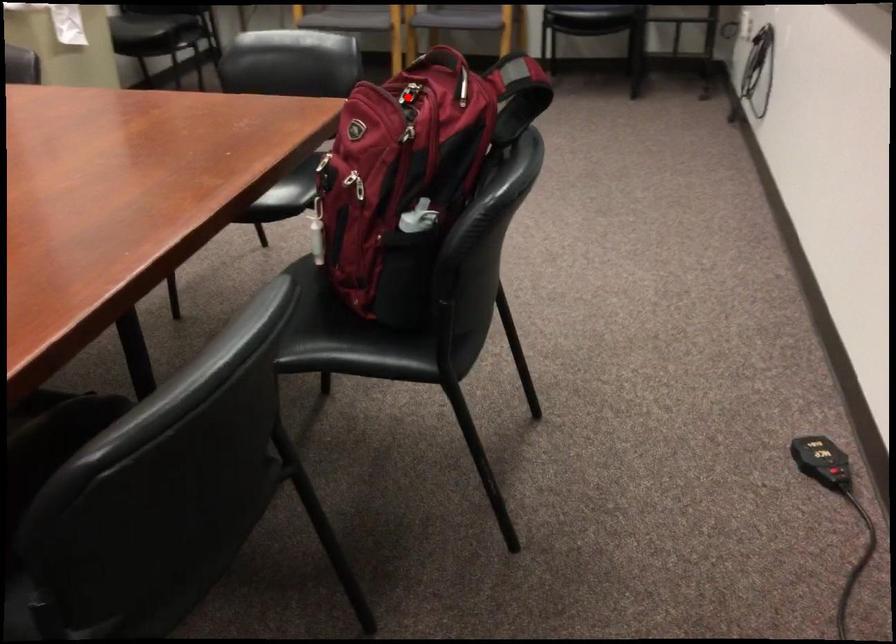
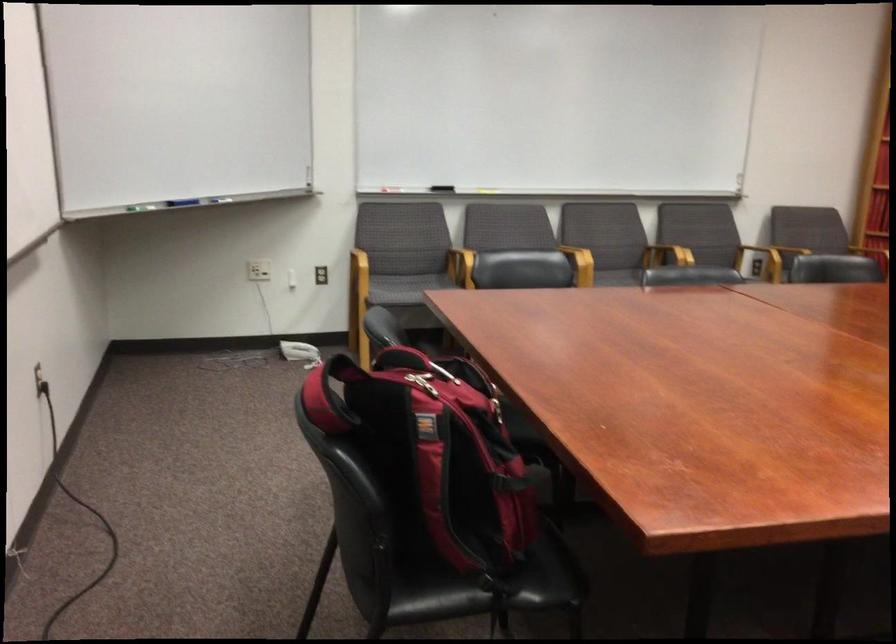
Question: I am providing you with two images of the same scene from different viewpoints. A red point is marked on the first image. At the location where the point appears in image 1, is it still visible in image 2?

Choices:
 (A) Yes
 (B) No

Answer: (B)